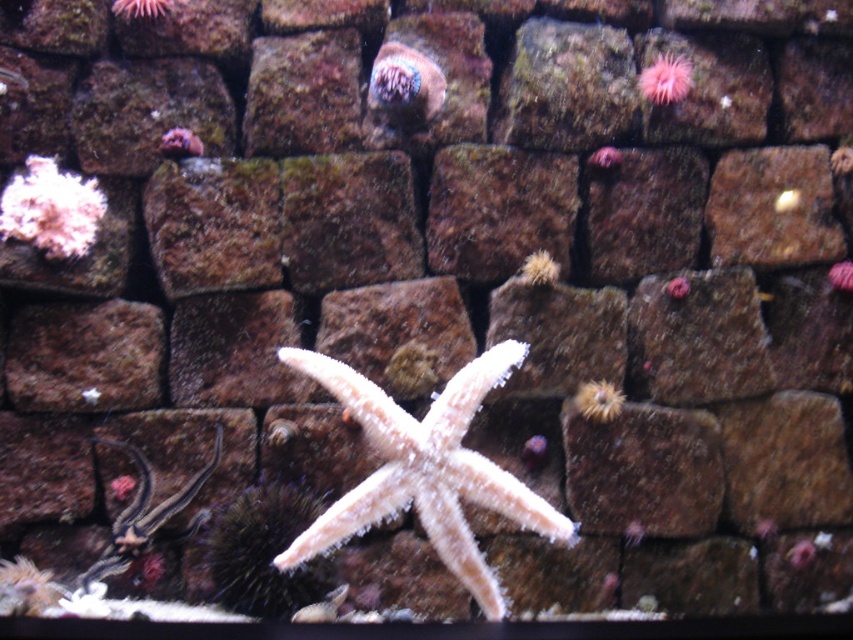
Question: Among these objects, which one is farthest from the camera?

Choices:
 (A) fuzzy orange sea anemone at center-right
 (B) pink coral at center
 (C) pink fuzzy anemone at upper right

Answer: (B)

Question: Is fuzzy orange sea anemone at center-right above pink coral at center?

Choices:
 (A) no
 (B) yes

Answer: (A)

Question: In this image, where is white matte starfish at center located relative to pink fuzzy anemone at upper right?

Choices:
 (A) below
 (B) above

Answer: (A)

Question: Is white matte starfish at center smaller than pink fuzzy anemone at upper right?

Choices:
 (A) yes
 (B) no

Answer: (B)

Question: Which object is closer to the camera taking this photo?

Choices:
 (A) pink coral at center
 (B) pink fuzzy anemone at upper right

Answer: (B)

Question: Based on their relative distances, which object is nearer to the pink coral at upper left?

Choices:
 (A) shiny blue coral at upper center
 (B) pink coral at center
 (C) fuzzy orange sea anemone at center-right

Answer: (A)